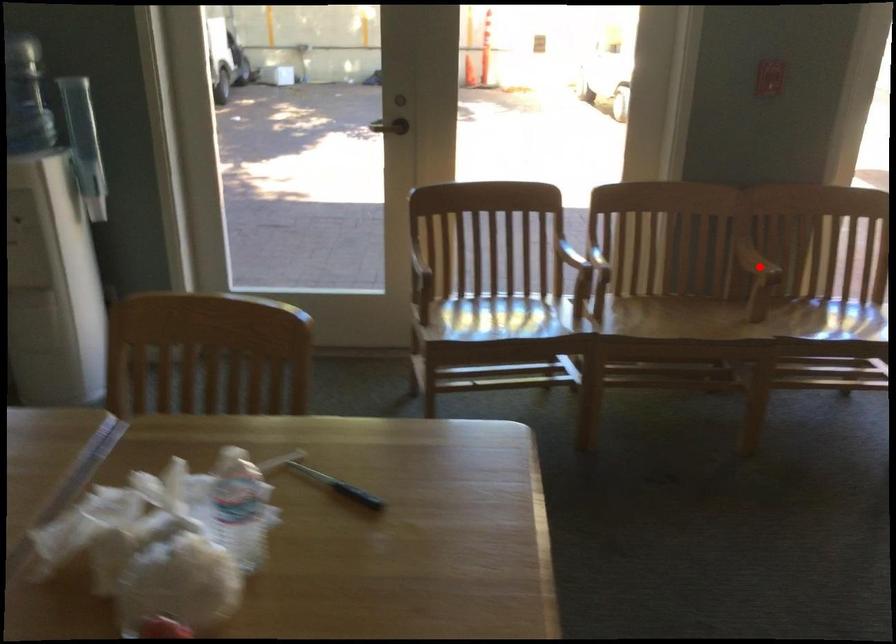
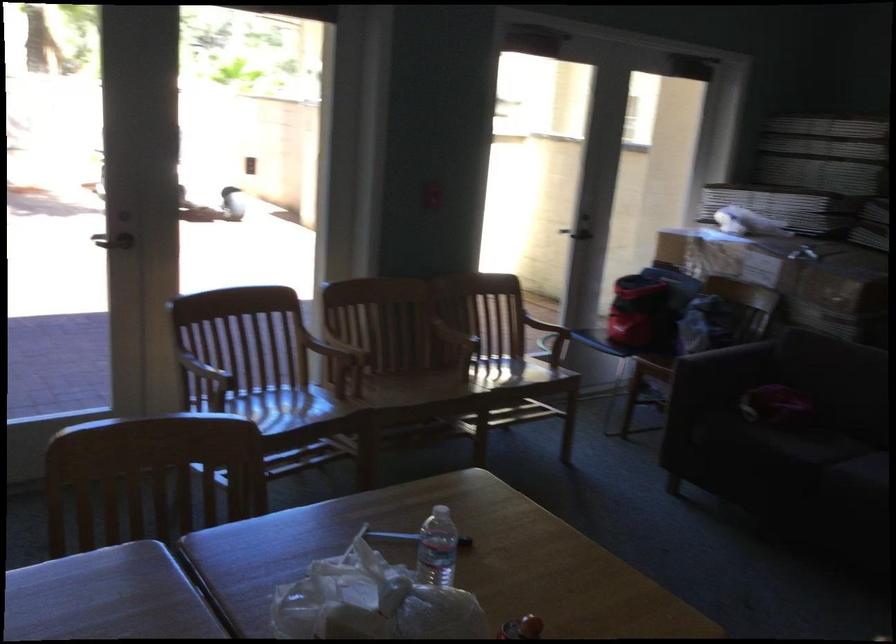
Question: I am providing you with two images of the same scene from different viewpoints. A red point is shown in image1. For the corresponding object point in image2, is it positioned nearer or farther from the camera?

Choices:
 (A) Nearer
 (B) Farther

Answer: (B)